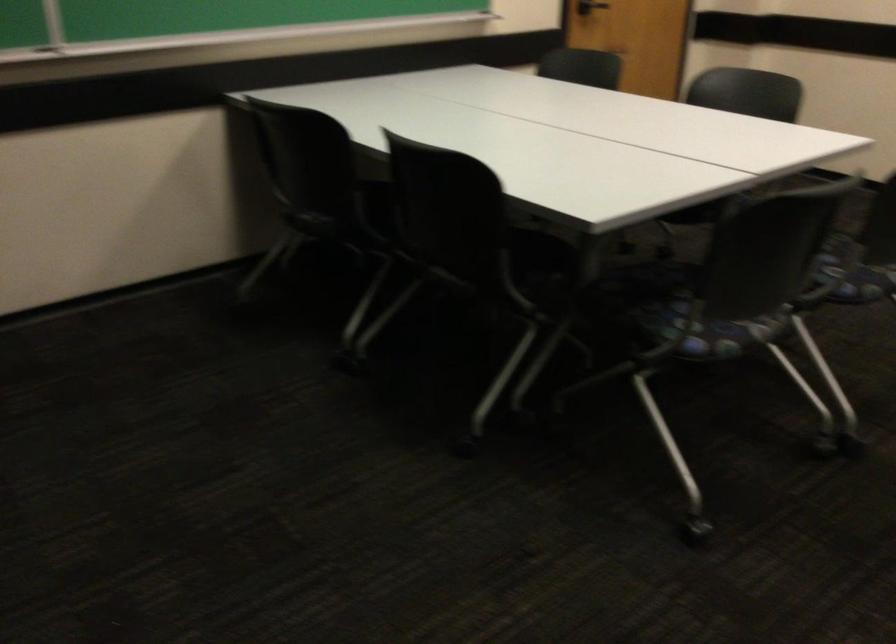
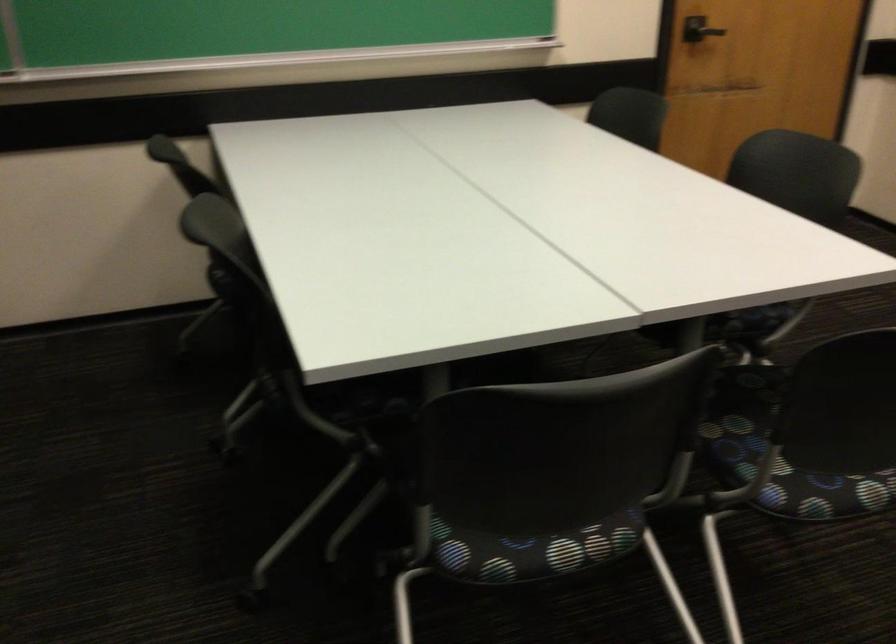
Find the pixel in the second image that matches (x=742, y=337) in the first image.

(531, 550)